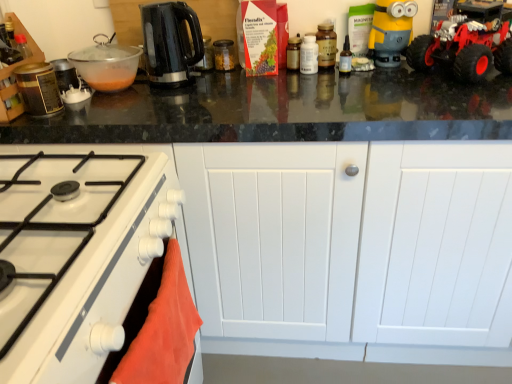
Question: Would you consider yellow matte minion toy at upper right to be distant from metallic canister at left, which ranks as the 7th kitchen appliance in right-to-left order?

Choices:
 (A) no
 (B) yes

Answer: (B)

Question: Is yellow matte minion toy at upper right not within metallic canister at left, which is the first kitchen appliance in left-to-right order?

Choices:
 (A) no
 (B) yes

Answer: (B)

Question: Can you confirm if yellow matte minion toy at upper right is bigger than metallic canister at left, which ranks as the 7th kitchen appliance in right-to-left order?

Choices:
 (A) no
 (B) yes

Answer: (B)

Question: Is yellow matte minion toy at upper right placed right next to metallic canister at left, which ranks as the 7th kitchen appliance in right-to-left order?

Choices:
 (A) no
 (B) yes

Answer: (A)

Question: Considering the relative positions of yellow matte minion toy at upper right and metallic canister at left, which ranks as the 7th kitchen appliance in right-to-left order, in the image provided, is yellow matte minion toy at upper right to the right of metallic canister at left, which ranks as the 7th kitchen appliance in right-to-left order, from the viewer's perspective?

Choices:
 (A) yes
 (B) no

Answer: (A)

Question: From the image's perspective, is transparent plastic bottle at center above or below metallic canister at left, which is the first kitchen appliance in left-to-right order?

Choices:
 (A) above
 (B) below

Answer: (A)

Question: Relative to metallic canister at left, which is the first kitchen appliance in left-to-right order, is transparent plastic bottle at center in front or behind?

Choices:
 (A) behind
 (B) front

Answer: (A)

Question: From a real-world perspective, is transparent plastic bottle at center above or below metallic canister at left, which ranks as the 7th kitchen appliance in right-to-left order?

Choices:
 (A) below
 (B) above

Answer: (A)

Question: In terms of height, does transparent plastic bottle at center look taller or shorter compared to metallic canister at left, which is the first kitchen appliance in left-to-right order?

Choices:
 (A) short
 (B) tall

Answer: (A)

Question: Considering the positions of white glossy bottle at center, which is the 6th kitchen appliance in left-to-right order, and transparent plastic bottle at center in the image, is white glossy bottle at center, which is the 6th kitchen appliance in left-to-right order, wider or thinner than transparent plastic bottle at center?

Choices:
 (A) thin
 (B) wide

Answer: (B)

Question: From the image's perspective, is white glossy bottle at center, which is the 6th kitchen appliance in left-to-right order, positioned above or below transparent plastic bottle at center?

Choices:
 (A) below
 (B) above

Answer: (B)

Question: Is white glossy bottle at center, the 2th kitchen appliance in the right-to-left sequence, inside the boundaries of transparent plastic bottle at center, or outside?

Choices:
 (A) outside
 (B) inside

Answer: (A)

Question: Is white glossy bottle at center, the 2th kitchen appliance in the right-to-left sequence, taller or shorter than transparent plastic bottle at center?

Choices:
 (A) tall
 (B) short

Answer: (B)

Question: From the image's perspective, is red rubber toy car at upper right above or below yellow matte minion toy at upper right?

Choices:
 (A) above
 (B) below

Answer: (B)

Question: Is point (455, 16) positioned closer to the camera than point (409, 16)?

Choices:
 (A) closer
 (B) farther

Answer: (A)